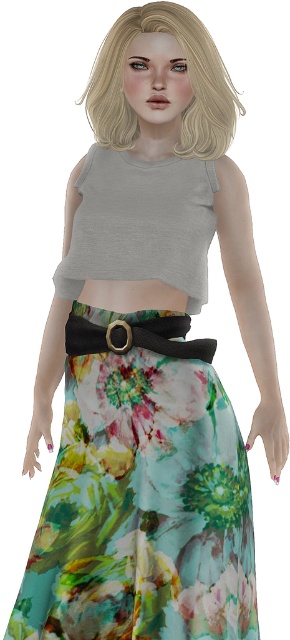
You are an artist trying to sketch this outfit. You want to draw the point at position point (x=145, y=12) and point (x=144, y=337) first. Which point should you draw first if you want to follow the order from front to back?

You should draw point (x=144, y=337) first because it is in front of point (x=145, y=12).

You are a fashion designer trying to create a new outfit. You have the floral chiffon skirt at lower center and the matte gray tank top at center. Based on their positions in the image, which clothing item is located lower on the body?

The floral chiffon skirt at lower center is positioned under the matte gray tank top at center, so it is located lower on the body.